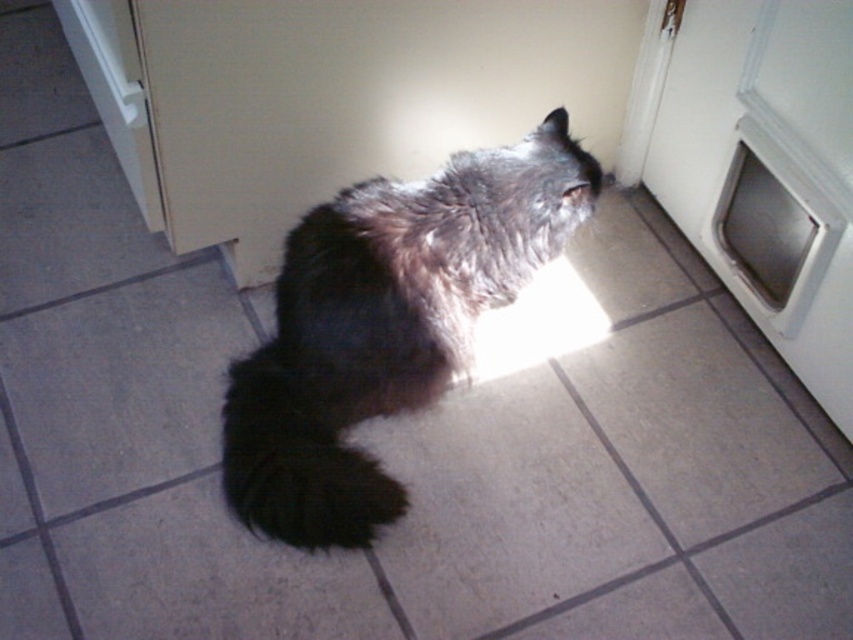
Question: Which point is farther from the camera taking this photo?

Choices:
 (A) (758, 266)
 (B) (469, 196)

Answer: (A)

Question: Which of the following is the closest to the observer?

Choices:
 (A) 306,392
 (B) 776,218

Answer: (A)

Question: Can you confirm if dark fur cat at center is smaller than white plastic pet door at center right?

Choices:
 (A) no
 (B) yes

Answer: (A)

Question: Can you confirm if dark fur cat at center is wider than white plastic pet door at center right?

Choices:
 (A) no
 (B) yes

Answer: (B)

Question: Is dark fur cat at center above black fluffy tail at lower center?

Choices:
 (A) no
 (B) yes

Answer: (B)

Question: Which point is farther from the camera taking this photo?

Choices:
 (A) (312, 317)
 (B) (780, 163)

Answer: (B)